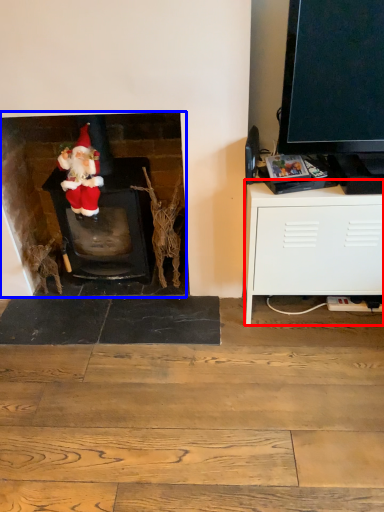
Question: Which of the following is the closest to the observer, cabinetry (highlighted by a red box) or fireplace (highlighted by a blue box)?

Choices:
 (A) cabinetry
 (B) fireplace

Answer: (A)